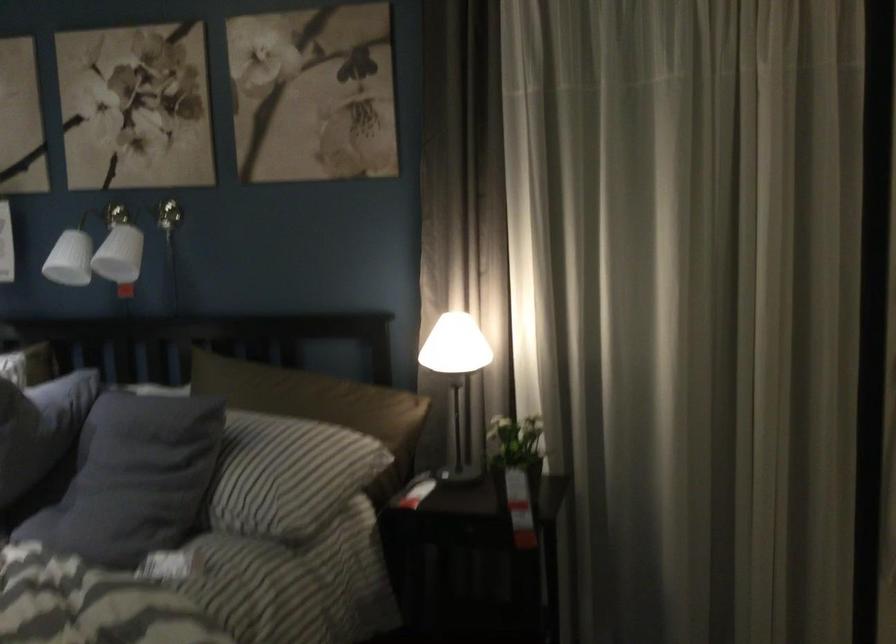
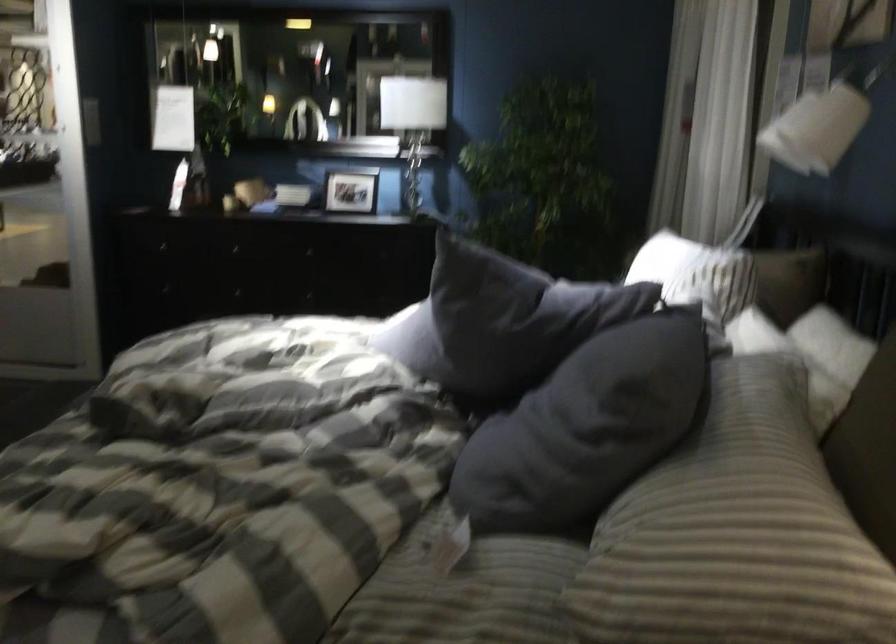
Find the pixel in the second image that matches (165,459) in the first image.

(596, 415)